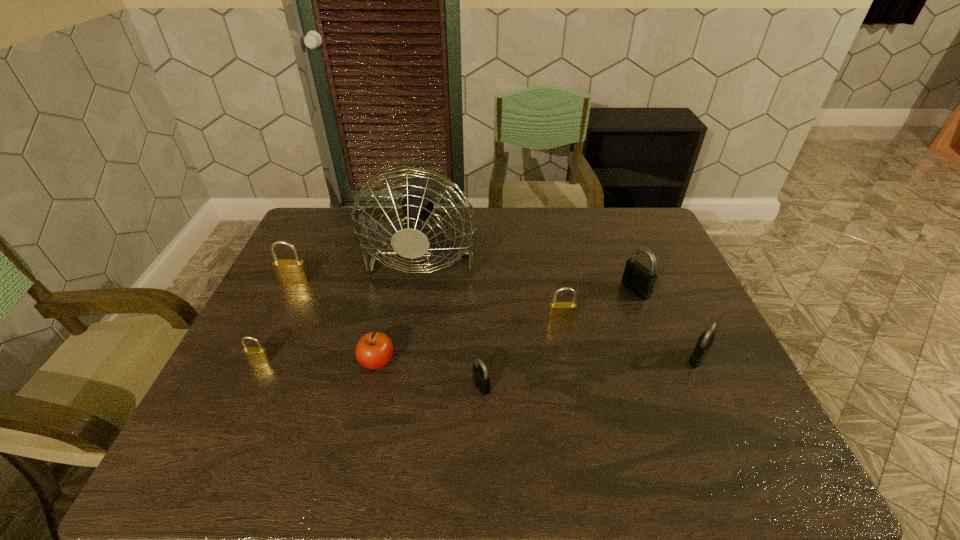
Identify the location of the tallest object. This screenshot has width=960, height=540. (408, 242).

Identify the location of the biggest black padlock. This screenshot has height=540, width=960. (639, 280).

Find the location of a particular element. the second black padlock from left to right is located at coordinates (639, 280).

Find the location of a particular element. This screenshot has height=540, width=960. the biggest brass padlock is located at coordinates (287, 271).

The height and width of the screenshot is (540, 960). Identify the location of the rightmost padlock. (705, 341).

Where is `the rightmost object`? Image resolution: width=960 pixels, height=540 pixels. the rightmost object is located at coordinates (705, 341).

What are the coordinates of `the second farthest brass padlock` in the screenshot? It's located at (559, 312).

The height and width of the screenshot is (540, 960). Find the location of `the second biggest brass padlock`. the second biggest brass padlock is located at coordinates (559, 312).

This screenshot has height=540, width=960. In order to click on apple in this screenshot , I will do `click(374, 350)`.

Find the location of a particular element. the leftmost black padlock is located at coordinates (481, 379).